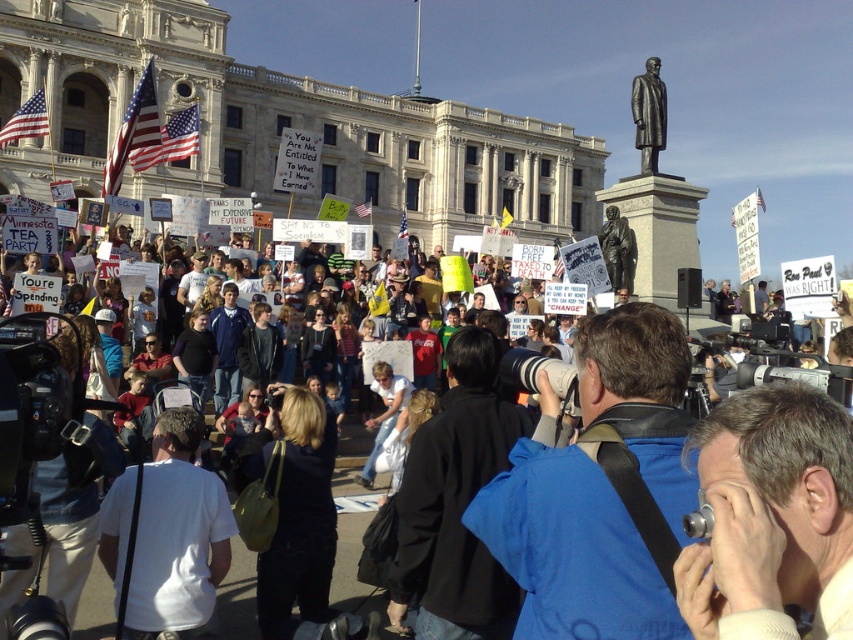
You are a photographer trying to capture a photo of the bronze statue at upper center and the bronze statue at center. Which statue should you focus on first if you want to include both in your frame without moving the camera?

The bronze statue at upper center is taller than the bronze statue at center, so you should focus on the bronze statue at upper center first to ensure it fits within the frame while still capturing the smaller statue at center.

You are a photographer at the protest, and you need to position your blue fabric camera at center to capture the crowd. Where exactly should you place it?

You should place the blue fabric camera at center at point (570, 541) to capture the crowd effectively.